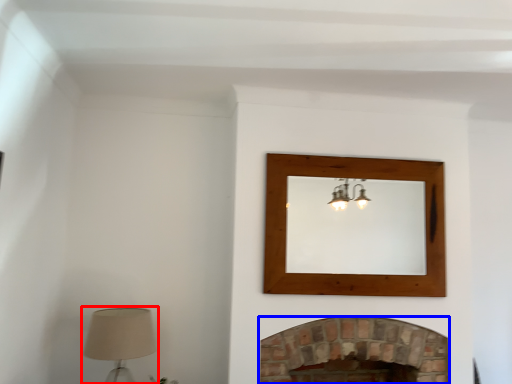
Question: Which object appears farthest to the camera in this image, table lamp (highlighted by a red box) or fireplace (highlighted by a blue box)?

Choices:
 (A) table lamp
 (B) fireplace

Answer: (B)